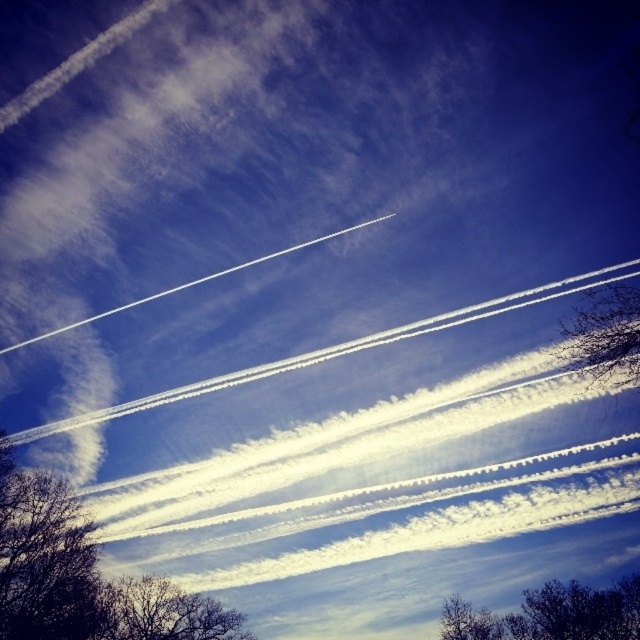
You are standing in a field looking up at the sky with two points marked in the image. The points are labeled as point (x=8, y=584) and point (x=20, y=557). Which point is closer to your eyes?

Point (x=8, y=584) is closer to the camera than point (x=20, y=557), so the point closer to your eyes is point (x=8, y=584).

You are standing in a field looking up at the sky. There is a point marked at coordinate (83, 573). What object in the scene corresponds to that point?

→ The point at coordinate (83, 573) corresponds to the silhouette bare tree at bottom left.